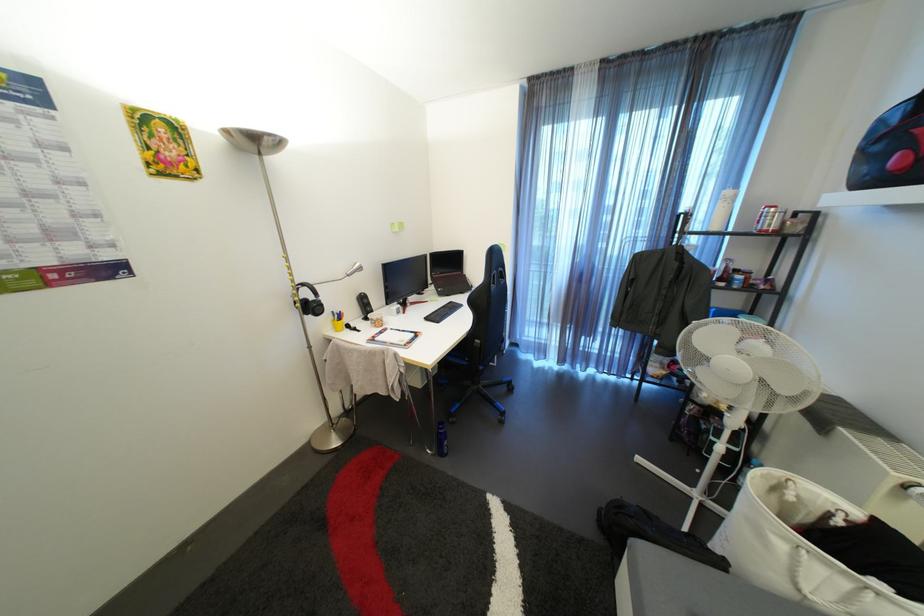
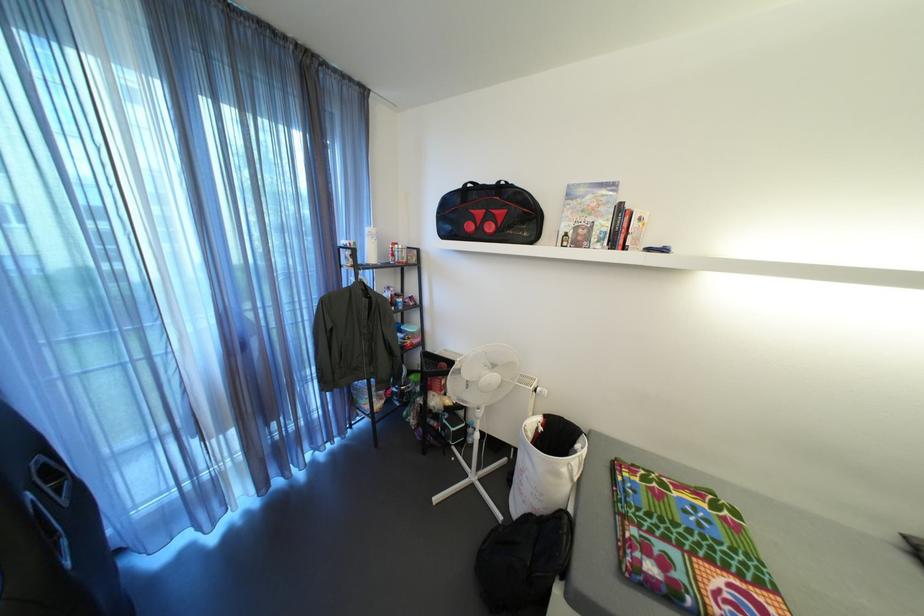
Question: The camera is either moving clockwise (left) or counter-clockwise (right) around the object. The first image is from the beginning of the video and the second image is from the end. Is the camera moving left or right when shooting the video?

Choices:
 (A) Left
 (B) Right

Answer: (A)